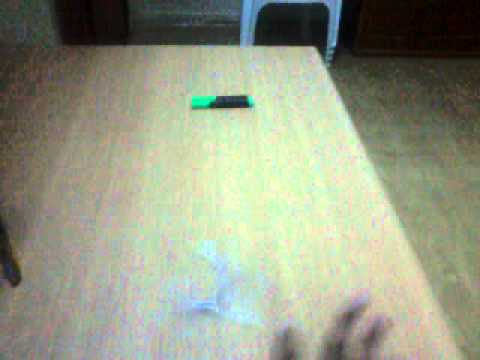
Where is `light wooden table`? light wooden table is located at coordinates (318, 241).